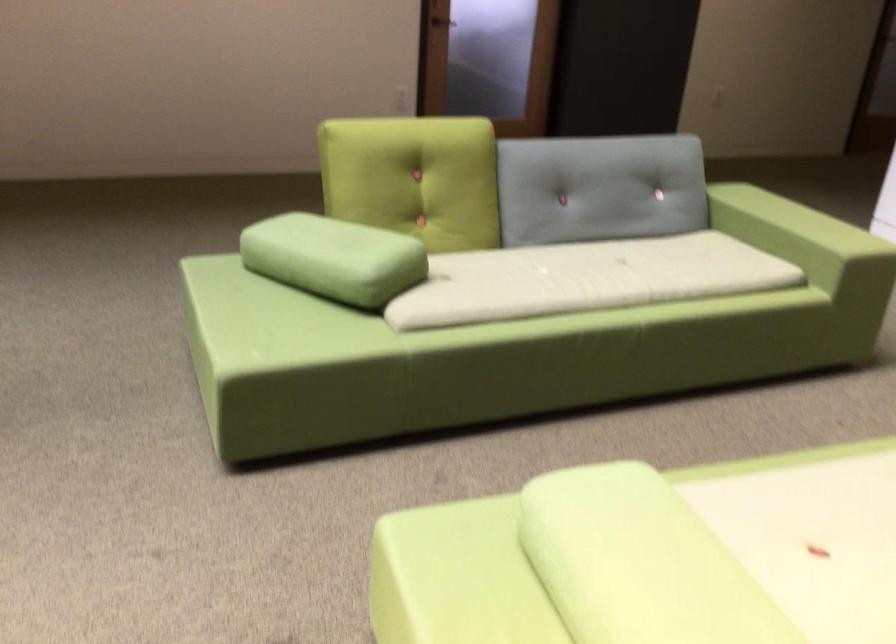
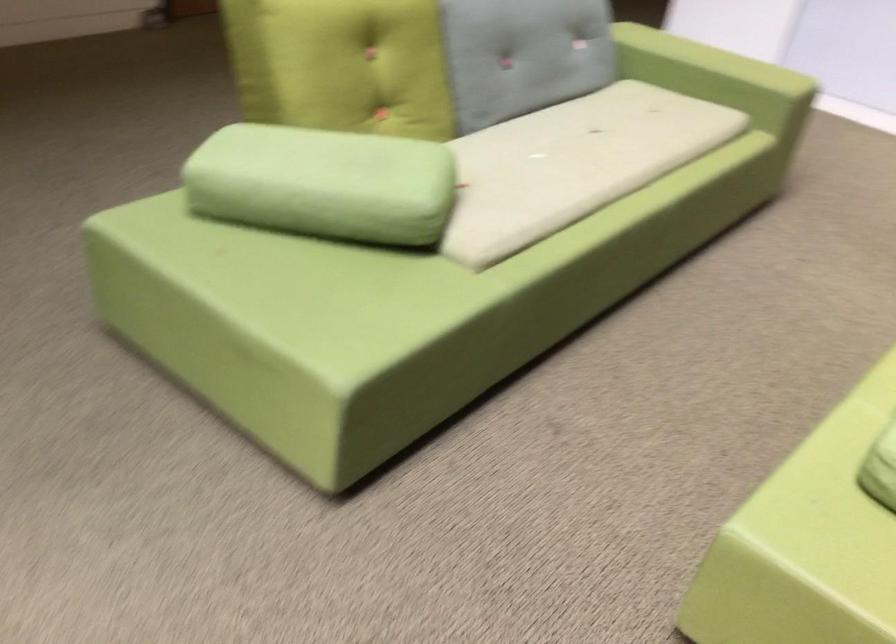
In the second image, find the point that corresponds to pixel 773 236 in the first image.

(717, 77)